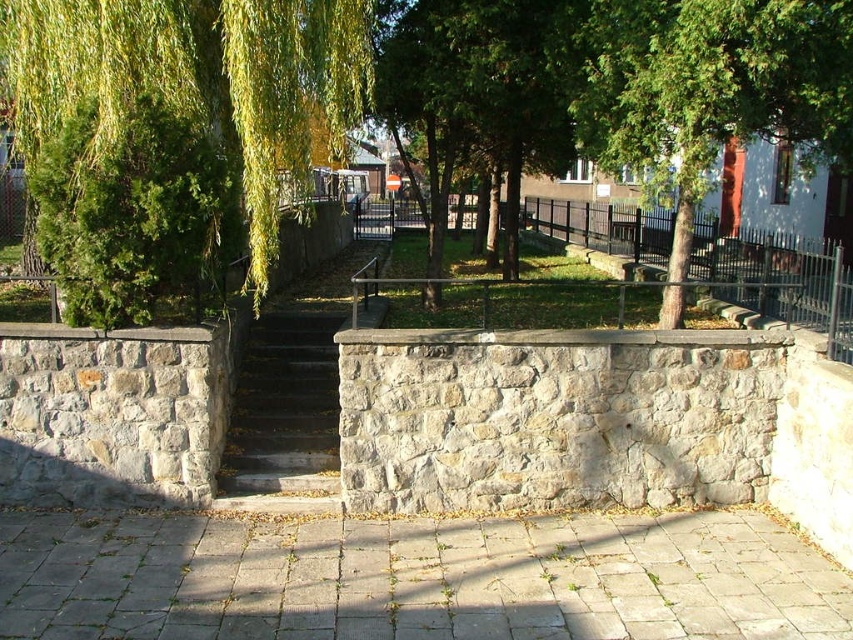
Consider the image. You are a gardener standing on the walkway and want to trim the green leafy willow at left. To reach the willow, do you need to step onto the dark gray stone stairs at center?

Answer: The green leafy willow at left is in front of the dark gray stone stairs at center, so you can reach it without stepping onto the stairs.

From the picture: You are a gardener who needs to water the green leafy willow at left and the dark gray stone stairs at center. Which object is closer to the water source located on the right side of the walkway?

The dark gray stone stairs at center is closer to the water source located on the right side of the walkway because the green leafy willow at left is positioned to the left of the stairs, meaning the stairs are between the willow and the water source on the right.